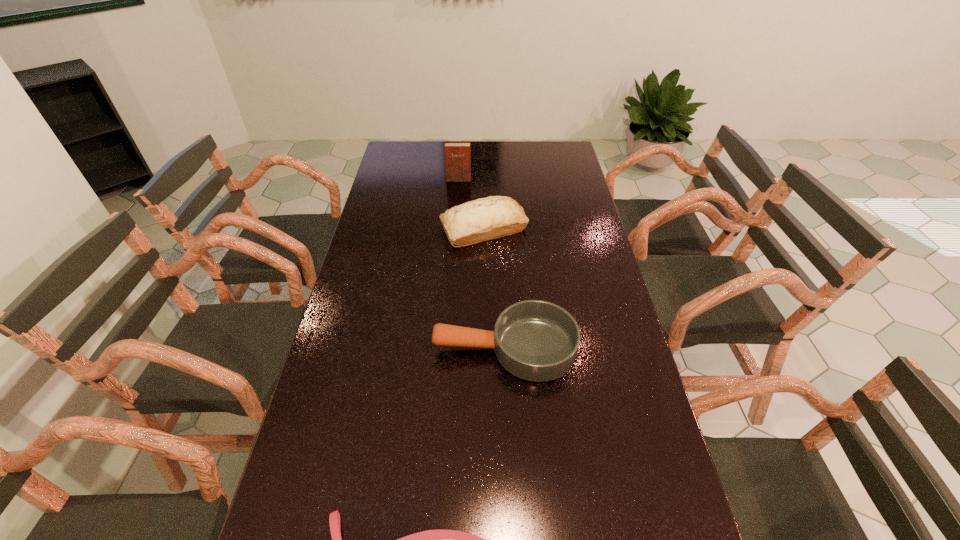
Locate an element on the screen. The image size is (960, 540). vacant area located on the handle side of the second shortest object is located at coordinates (336, 348).

At what (x,y) coordinates should I click in order to perform the action: click on object situated at the right edge. Please return your answer as a coordinate pair (x, y). Looking at the image, I should click on (535, 340).

Locate an element on the screen. free space at the far edge of the desktop is located at coordinates (535, 159).

Identify the location of vacant position at the left edge of the desktop. (357, 449).

Locate an element on the screen. The image size is (960, 540). vacant space at the right edge of the desktop is located at coordinates (598, 237).

The height and width of the screenshot is (540, 960). I want to click on free space at the far right corner, so click(x=574, y=161).

This screenshot has width=960, height=540. I want to click on free area in between the third farthest object and the diary, so click(482, 264).

The image size is (960, 540). I want to click on free space that is in between the third tallest object and the farthest object, so click(x=482, y=264).

In order to click on vacant area that lies between the third shortest object and the third farthest object in this screenshot , I will do `click(494, 288)`.

Locate which object ranks in proximity to the farthest object. Please provide its 2D coordinates. Your answer should be formatted as a tuple, i.e. [(x, y)], where the tuple contains the x and y coordinates of a point satisfying the conditions above.

[(492, 217)]